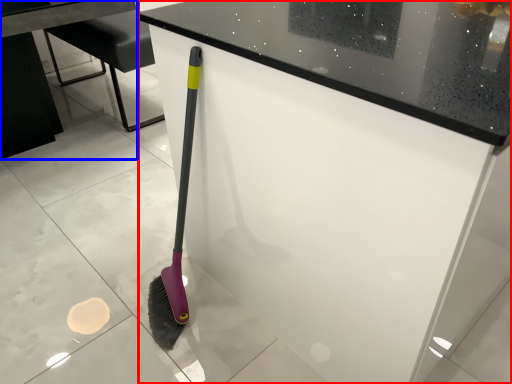
Question: Which of the following is the closest to the observer, counter (highlighted by a red box) or table (highlighted by a blue box)?

Choices:
 (A) counter
 (B) table

Answer: (A)